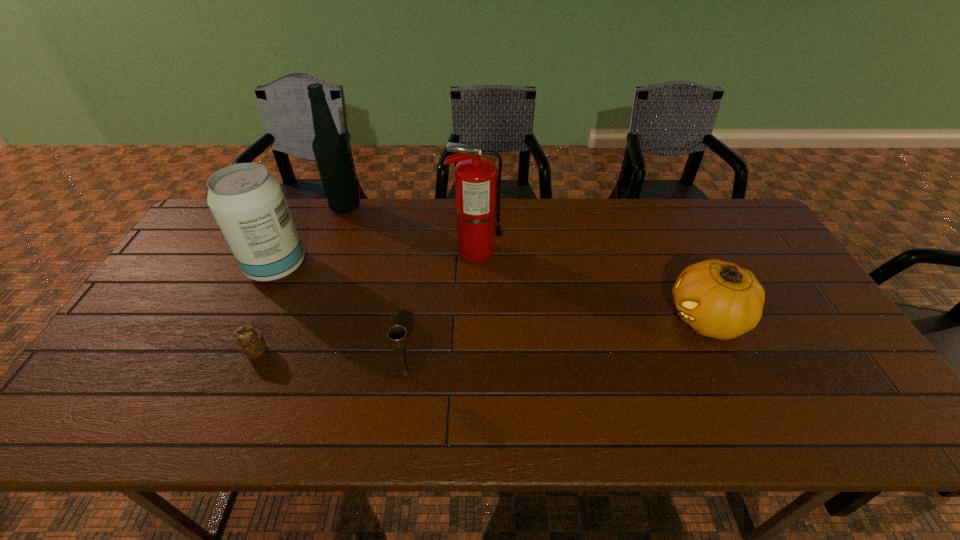
Locate an element on the screen. The image size is (960, 540). the right alcohol is located at coordinates (330, 149).

Identify the location of the farthest object. (330, 149).

Find the location of `fire extinguisher`. fire extinguisher is located at coordinates point(477,189).

This screenshot has height=540, width=960. What are the coordinates of `the fifth object from left to right` in the screenshot? It's located at (477, 189).

I want to click on the shorter alcohol, so click(248, 203).

Locate an element on the screen. The width and height of the screenshot is (960, 540). the nearer alcohol is located at coordinates (248, 203).

I want to click on the fourth tallest object, so click(717, 299).

Image resolution: width=960 pixels, height=540 pixels. What are the coordinates of `pumpkin` in the screenshot? It's located at (717, 299).

At what (x,y) coordinates should I click in order to perform the action: click on chalice. Please return your answer as a coordinate pair (x, y). The width and height of the screenshot is (960, 540). Looking at the image, I should click on (397, 335).

I want to click on the fifth tallest object, so click(397, 335).